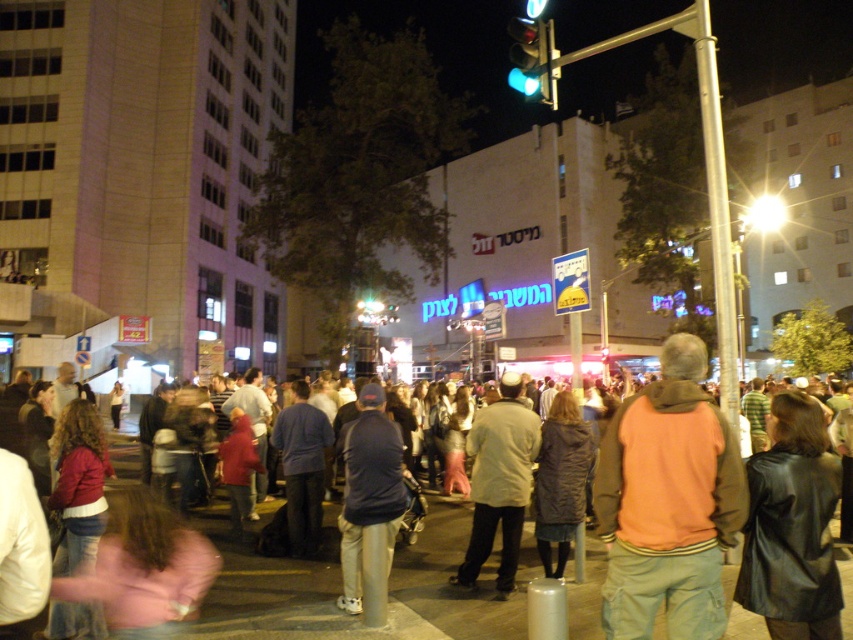
You are a photographer at the event and want to capture both the dark blue jacket at center and the light brown leather jacket at center in a single frame. Which jacket should you focus on to ensure both are in the shot without needing to adjust your camera angle?

You should focus on the light brown leather jacket at center because it is taller than the dark blue jacket at center, so keeping it centered will ensure both are captured in the frame.

You are a photographer trying to capture both the dark gray jacket at center and the light brown leather jacket at center in a single frame. Based on their widths, which jacket might require you to adjust your camera angle to ensure it fits entirely in the photo?

The dark gray jacket at center might be wider than the light brown leather jacket at center, so adjusting the camera angle might be necessary to include the entire width of the dark gray jacket at center in the photo.

You are a photographer standing in the crowd at the city square event. You notice two jackets in the center of the image. Which jacket is closer to the ground, the dark blue jacket at center or the light brown leather jacket at center?

The dark blue jacket at center is positioned under the light brown leather jacket at center, so it is closer to the ground.